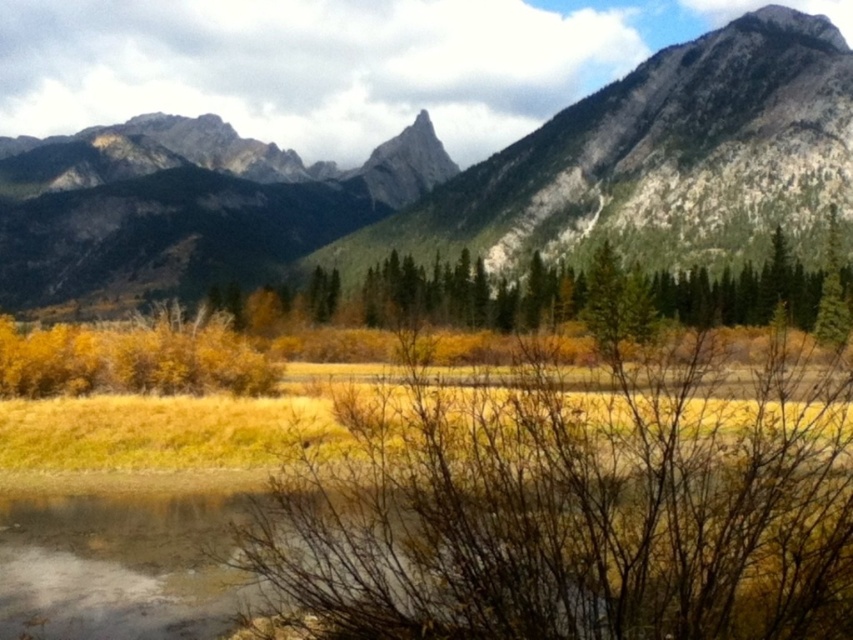
Question: Is brown dirt at lower left below green coniferous trees at center?

Choices:
 (A) no
 (B) yes

Answer: (B)

Question: In this image, where is brown dirt at lower left located relative to green coniferous trees at center?

Choices:
 (A) right
 (B) left

Answer: (B)

Question: Which object appears farthest from the camera in this image?

Choices:
 (A) brown dirt at lower left
 (B) rocky gray mountain range at upper center

Answer: (B)

Question: Does rocky gray mountain range at upper center come behind green coniferous trees at center?

Choices:
 (A) no
 (B) yes

Answer: (B)

Question: Which object is closer to the camera taking this photo?

Choices:
 (A) green coniferous trees at center
 (B) brown dirt at lower left

Answer: (B)

Question: Which point is closer to the camera?

Choices:
 (A) (822, 310)
 (B) (741, 93)

Answer: (A)